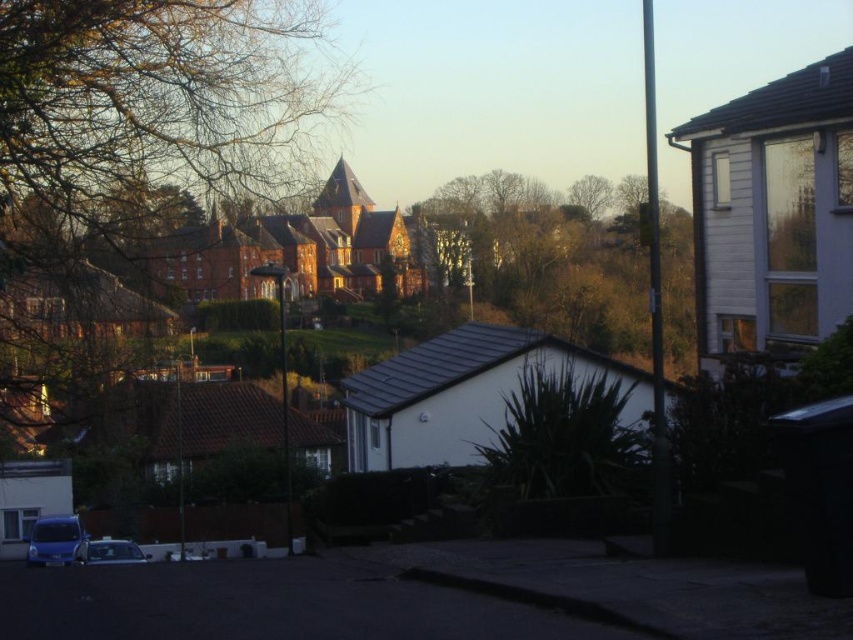
Does green leafy tree at center lie in front of metallic blue van at lower left?

Yes, it is in front of metallic blue van at lower left.

Consider the image. Who is positioned more to the left, green leafy tree at center or metallic blue van at lower left?

metallic blue van at lower left is more to the left.

The height and width of the screenshot is (640, 853). In order to click on green leafy tree at center in this screenshot , I will do `click(544, 253)`.

Between metallic blue van at lower left and shiny silver car at lower left, which one is positioned higher?

Positioned higher is metallic blue van at lower left.

Where is `metallic blue van at lower left`? Image resolution: width=853 pixels, height=640 pixels. metallic blue van at lower left is located at coordinates (56, 541).

How distant is bare branches at upper left from metallic blue van at lower left?

bare branches at upper left is 35.50 feet from metallic blue van at lower left.

Who is taller, bare branches at upper left or metallic blue van at lower left?

With more height is bare branches at upper left.

This screenshot has height=640, width=853. I want to click on bare branches at upper left, so click(x=148, y=113).

The height and width of the screenshot is (640, 853). What are the coordinates of `bare branches at upper left` in the screenshot? It's located at (148, 113).